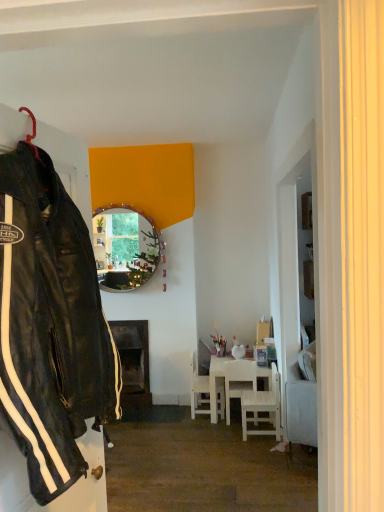
This screenshot has width=384, height=512. In order to click on vacant area that is in front of white wooden chair at lower right, the first chair when ordered from front to back in this screenshot , I will do `click(252, 449)`.